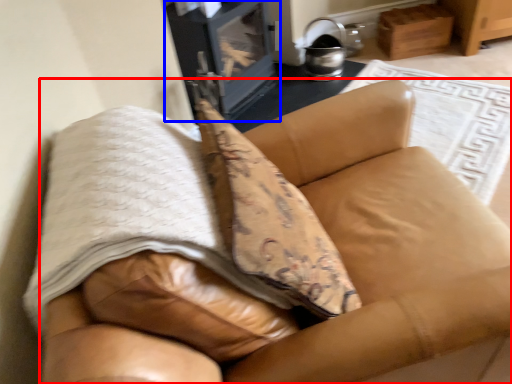
Question: Which of the following is the farthest to the observer, furniture (highlighted by a red box) or stove (highlighted by a blue box)?

Choices:
 (A) furniture
 (B) stove

Answer: (B)